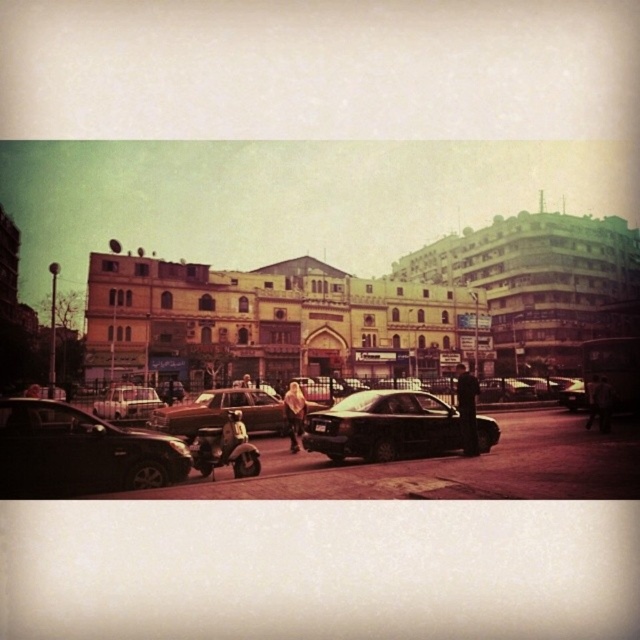
Question: Does shiny black car at lower left appear over brown matte car at center?

Choices:
 (A) no
 (B) yes

Answer: (A)

Question: Which point is closer to the camera?

Choices:
 (A) matte silver sedan at center
 (B) satin black sedan at center
 (C) brown matte car at center

Answer: (B)

Question: In this image, where is shiny black car at lower left located relative to matte silver sedan at center?

Choices:
 (A) below
 (B) above

Answer: (A)

Question: Which of the following is the farthest from the observer?

Choices:
 (A) shiny black sedan at center
 (B) matte silver sedan at center

Answer: (A)

Question: Which point is closer to the camera taking this photo?

Choices:
 (A) (150, 408)
 (B) (404, 417)
 (C) (568, 397)

Answer: (B)

Question: From the image, what is the correct spatial relationship of matte silver sedan at center in relation to shiny black sedan at center?

Choices:
 (A) right
 (B) left

Answer: (B)